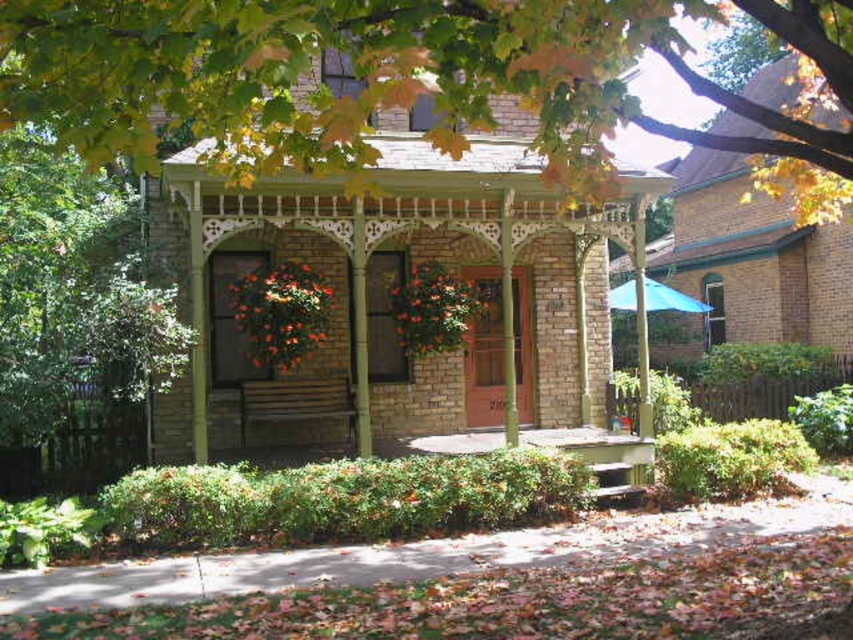
Question: Is green leafy tree at upper center below green wood gazebo at center?

Choices:
 (A) yes
 (B) no

Answer: (B)

Question: Which object is closer to the camera taking this photo?

Choices:
 (A) green leafy tree at upper center
 (B) green wood gazebo at center

Answer: (A)

Question: Can you confirm if green leafy tree at upper center is thinner than green wood gazebo at center?

Choices:
 (A) no
 (B) yes

Answer: (B)

Question: In this image, where is green leafy tree at upper center located relative to green wood gazebo at center?

Choices:
 (A) left
 (B) right

Answer: (B)

Question: Which point is farther from the camera taking this photo?

Choices:
 (A) (531, 52)
 (B) (518, 259)

Answer: (B)